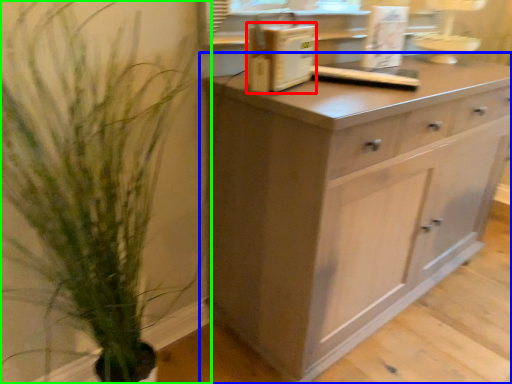
Question: Estimate the real-world distances between objects in this image. Which object is closer to appliance (highlighted by a red box), chest of drawers (highlighted by a blue box) or houseplant (highlighted by a green box)?

Choices:
 (A) chest of drawers
 (B) houseplant

Answer: (A)